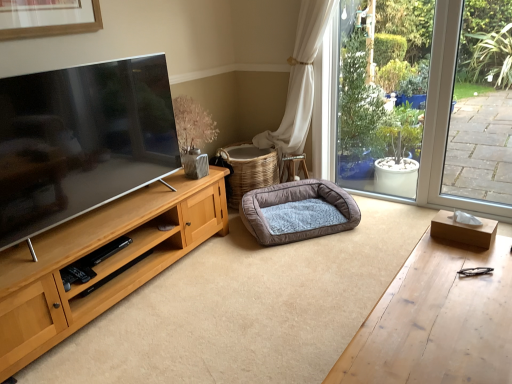
The height and width of the screenshot is (384, 512). What are the coordinates of `free space to the left of wooden desk at lower right` in the screenshot? It's located at (255, 341).